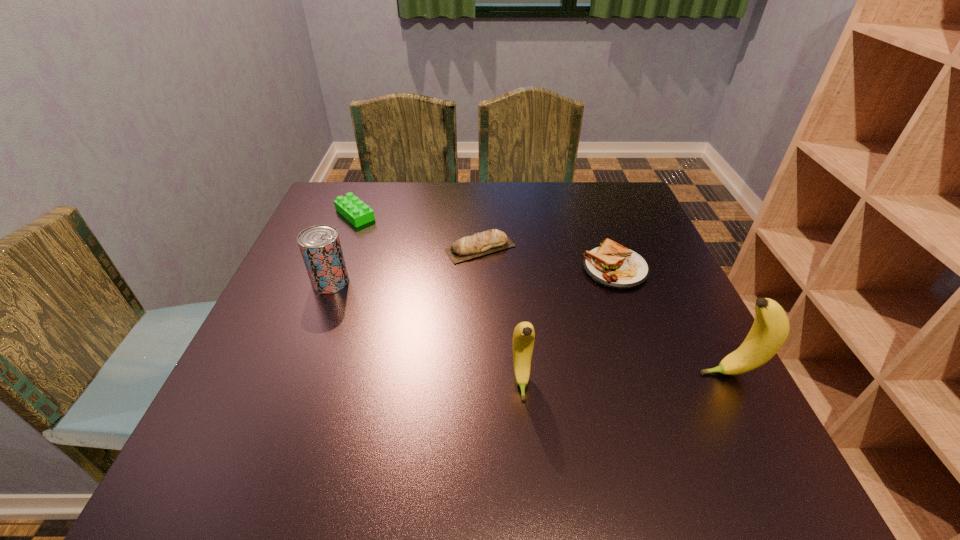
In the current image, all bananas are evenly spaced. To maintain this equal spacing, where should an additional banana be placed on the left? Please point out a free spot. Please provide its 2D coordinates. Your answer should be formatted as a tuple, i.e. [(x, y)], where the tuple contains the x and y coordinates of a point satisfying the conditions above.

[(307, 390)]